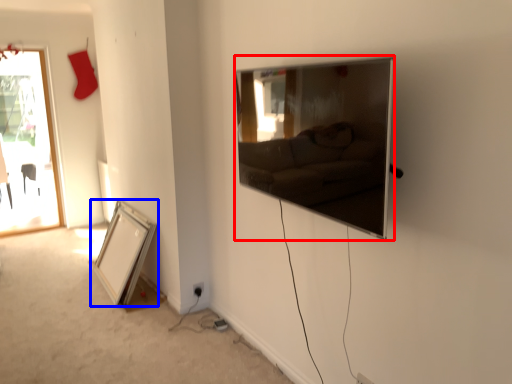
Question: Which object is further to the camera taking this photo, picture frame (highlighted by a red box) or picture frame (highlighted by a blue box)?

Choices:
 (A) picture frame
 (B) picture frame

Answer: (B)